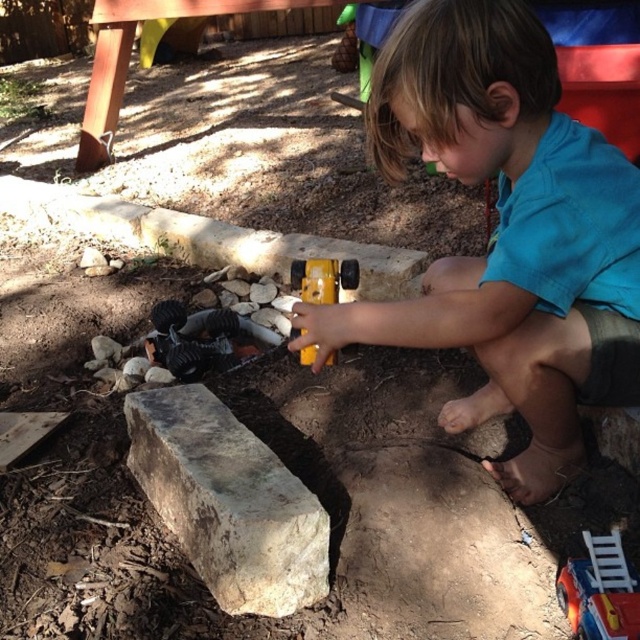
Does gray rough stone at center have a greater height compared to metallic silver toy truck at lower right?

Indeed, gray rough stone at center has a greater height compared to metallic silver toy truck at lower right.

Can you confirm if gray rough stone at center is positioned above metallic silver toy truck at lower right?

Yes.

Identify the location of gray rough stone at center. (227, 500).

Who is positioned more to the left, gray rough stone at center or yellow plastic hammer at center?

Positioned to the left is gray rough stone at center.

Can you confirm if gray rough stone at center is positioned above yellow plastic hammer at center?

No, gray rough stone at center is not above yellow plastic hammer at center.

Which is behind, point (292, 524) or point (312, 352)?

The point (312, 352) is behind.

Find the location of a particular element. gray rough stone at center is located at coordinates (227, 500).

Which is more to the left, blue matte shirt at center or yellow plastic hammer at center?

Positioned to the left is yellow plastic hammer at center.

Is point (344, 307) closer to viewer compared to point (296, 284)?

Yes, it is in front of point (296, 284).

This screenshot has width=640, height=640. I want to click on blue matte shirt at center, so click(x=506, y=234).

Identify the location of blue matte shirt at center. The image size is (640, 640). (506, 234).